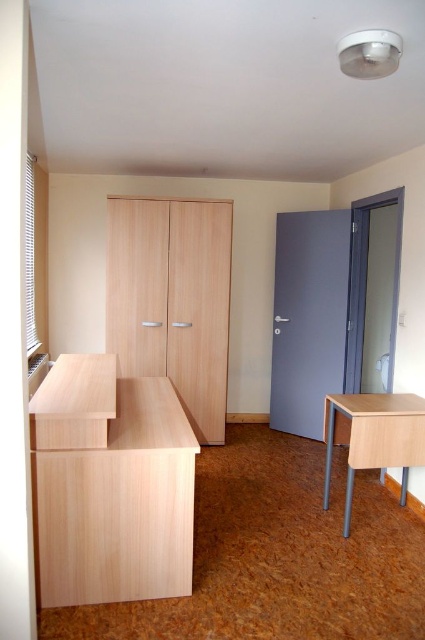
From the picture: Can you confirm if matte wood desk at center is shorter than light wood table at lower left?

No.

Can you confirm if matte wood desk at center is wider than light wood table at lower left?

Yes.

Image resolution: width=425 pixels, height=640 pixels. I want to click on matte wood desk at center, so click(119, 506).

Is light wood table at lower left positioned behind matte wood drawer at lower right?

That is False.

Which is above, light wood table at lower left or matte wood drawer at lower right?

light wood table at lower left

Does point (85, 440) come in front of point (333, 436)?

Yes, it is.

Locate an element on the screen. The image size is (425, 640). light wood table at lower left is located at coordinates (73, 403).

Between point (325, 476) and point (340, 433), which one is positioned in front?

Point (340, 433)

Which is below, light brown wooden table at right or matte wood drawer at lower right?

light brown wooden table at right

Find the location of a particular element. Image resolution: width=425 pixels, height=640 pixels. light brown wooden table at right is located at coordinates (376, 436).